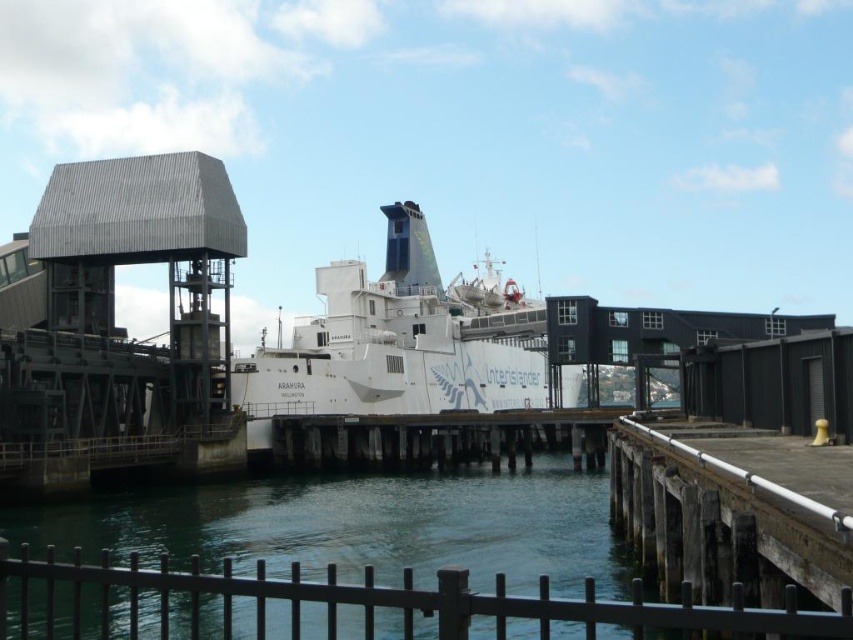
Question: Based on their relative distances, which object is farther from the white matte ship at center?

Choices:
 (A) wooden at center
 (B) greenish water at lower center

Answer: (B)

Question: Where is greenish water at lower center located in relation to wooden at center in the image?

Choices:
 (A) above
 (B) below

Answer: (B)

Question: Which of the following is the closest to the observer?

Choices:
 (A) white matte ship at center
 (B) wooden at center
 (C) greenish water at lower center

Answer: (C)

Question: Which object is farther from the camera taking this photo?

Choices:
 (A) greenish water at lower center
 (B) white matte ship at center
 (C) wooden at center

Answer: (B)

Question: Is greenish water at lower center positioned at the back of wooden at center?

Choices:
 (A) yes
 (B) no

Answer: (B)

Question: Considering the relative positions of greenish water at lower center and white matte ship at center in the image provided, where is greenish water at lower center located with respect to white matte ship at center?

Choices:
 (A) right
 (B) left

Answer: (B)